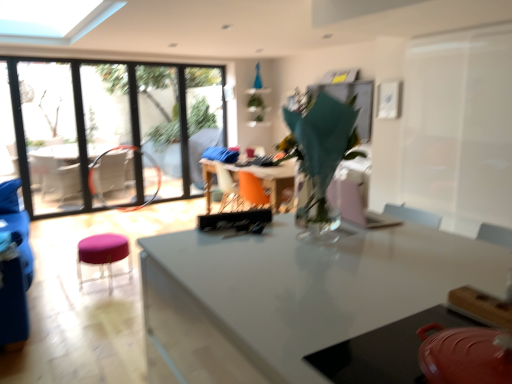
Question: Can you confirm if matte red pot at lower right, the 2th table when ordered from top to bottom, is smaller than purple fabric stool at lower left?

Choices:
 (A) no
 (B) yes

Answer: (B)

Question: Would you say matte red pot at lower right, which ranks as the first table in bottom-to-top order, contains purple fabric stool at lower left?

Choices:
 (A) yes
 (B) no

Answer: (B)

Question: From the image's perspective, would you say matte red pot at lower right, the 2th table when ordered from top to bottom, is positioned over purple fabric stool at lower left?

Choices:
 (A) no
 (B) yes

Answer: (B)

Question: From a real-world perspective, is matte red pot at lower right, the 2th table when ordered from top to bottom, under purple fabric stool at lower left?

Choices:
 (A) no
 (B) yes

Answer: (A)

Question: Does matte red pot at lower right, which ranks as the first table in bottom-to-top order, have a greater height compared to purple fabric stool at lower left?

Choices:
 (A) yes
 (B) no

Answer: (B)

Question: Considering the relative positions of matte red pot at lower right, acting as the 2th table starting from the back, and purple fabric stool at lower left in the image provided, is matte red pot at lower right, acting as the 2th table starting from the back, in front of purple fabric stool at lower left?

Choices:
 (A) no
 (B) yes

Answer: (B)

Question: Is translucent glass vase at center positioned far away from purple fabric stool at lower left?

Choices:
 (A) no
 (B) yes

Answer: (B)

Question: From the image's perspective, is translucent glass vase at center on purple fabric stool at lower left?

Choices:
 (A) yes
 (B) no

Answer: (A)

Question: Is translucent glass vase at center smaller than purple fabric stool at lower left?

Choices:
 (A) yes
 (B) no

Answer: (B)

Question: Is translucent glass vase at center aimed at purple fabric stool at lower left?

Choices:
 (A) no
 (B) yes

Answer: (B)

Question: Does translucent glass vase at center appear on the left side of purple fabric stool at lower left?

Choices:
 (A) yes
 (B) no

Answer: (B)

Question: From a real-world perspective, is translucent glass vase at center below purple fabric stool at lower left?

Choices:
 (A) yes
 (B) no

Answer: (B)

Question: Does transparent glass window at left lie behind matte red pot at lower right, which ranks as the 1th table in front-to-back order?

Choices:
 (A) no
 (B) yes

Answer: (B)